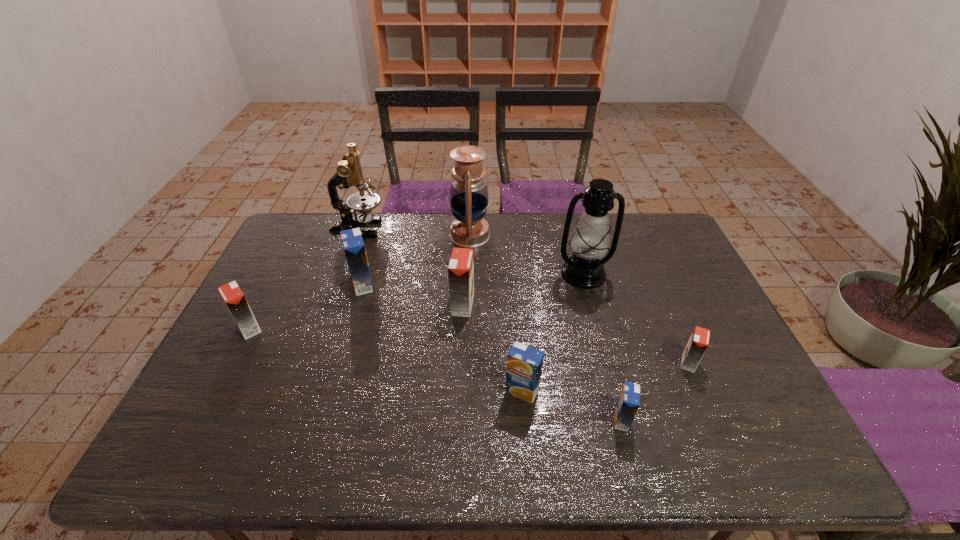
Locate an element on the screen. vacant position located 0.060m on the right of the second orange_juice from left to right is located at coordinates (396, 285).

Image resolution: width=960 pixels, height=540 pixels. I want to click on free space located on the front of the second orange orange juice from left to right, so click(x=457, y=447).

I want to click on vacant space located on the back of the leftmost orange orange juice, so click(x=288, y=252).

Find the location of a particular element. free point located on the front of the second smallest blue orange_juice is located at coordinates (525, 427).

I want to click on vacant space situated 0.090m on the back of the smallest orange orange juice, so click(673, 328).

I want to click on vacant space situated on the back of the nearest blue orange_juice, so click(x=597, y=326).

This screenshot has height=540, width=960. What are the coordinates of `microscope that is at the far edge` in the screenshot? It's located at (349, 172).

Identify the location of oil lamp present at the far edge. The image size is (960, 540). click(469, 197).

Identify the location of object that is at the near edge. Image resolution: width=960 pixels, height=540 pixels. (628, 403).

Image resolution: width=960 pixels, height=540 pixels. I want to click on microscope at the left edge, so click(x=349, y=172).